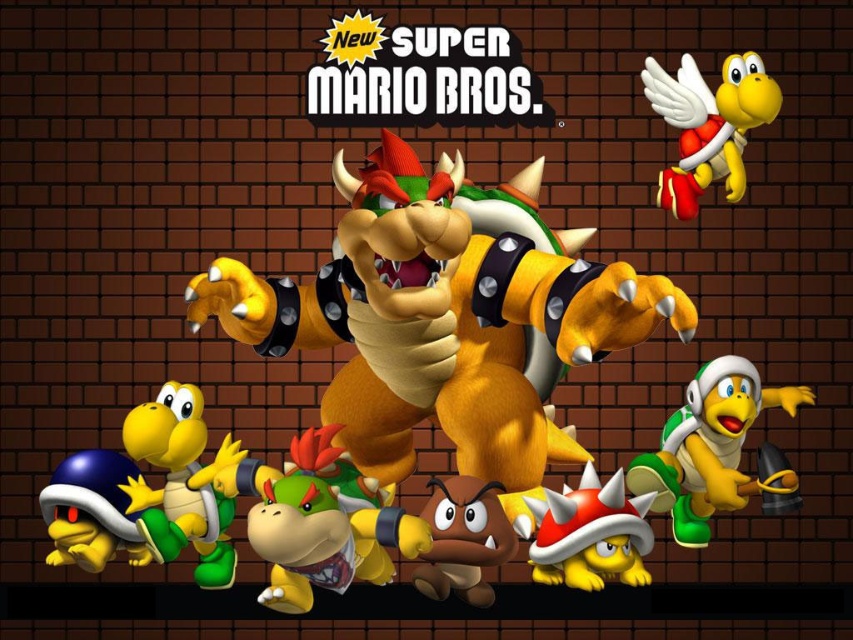
Question: Among these points, which one is farthest from the camera?

Choices:
 (A) (668, 76)
 (B) (189, 541)
 (C) (720, 465)

Answer: (B)

Question: Is brown rubber turtle at center above shiny yellow turtle shell at center?

Choices:
 (A) yes
 (B) no

Answer: (A)

Question: Is brown rubber turtle at center to the left of yellow rubber turtle at lower left from the viewer's perspective?

Choices:
 (A) no
 (B) yes

Answer: (A)

Question: Which object is positioned farthest from the green rubber koopa troopa at center?

Choices:
 (A) yellow rubber turtle at lower left
 (B) brown rubber turtle at center

Answer: (A)

Question: Which point is closer to the camera?

Choices:
 (A) green rubber turtle at center
 (B) brown matte koopa troopa at center
 (C) shiny yellow turtle shell at center
 (D) green rubber koopa troopa at center

Answer: (A)

Question: Does yellow rubber turtle at lower left appear under brown matte koopa troopa at center?

Choices:
 (A) no
 (B) yes

Answer: (A)